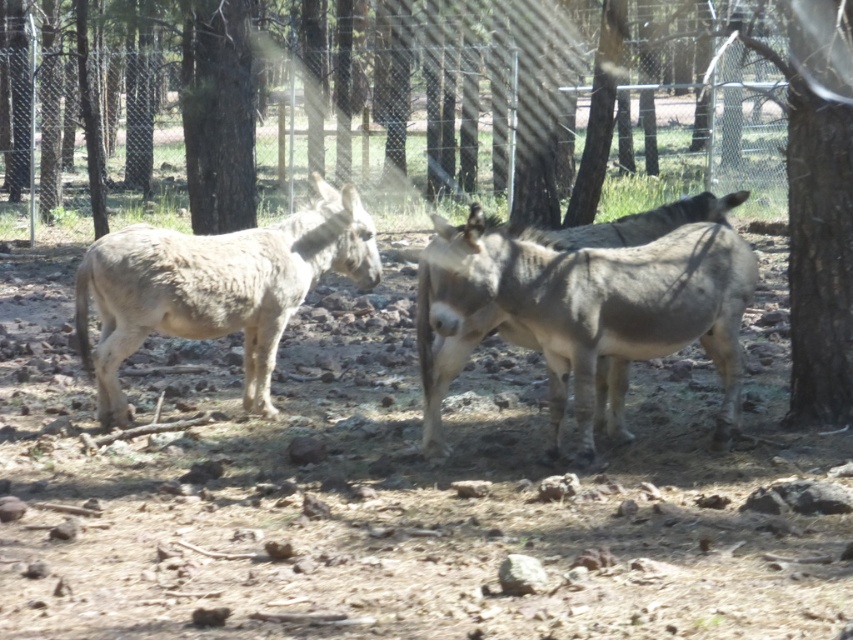
You are standing in front of the fence and looking at the two points marked on the image. Which point, point (457, 458) or point (90, 282), is closer to you?

Point (457, 458) is closer to you than point (90, 282).

Consider the image. You are standing in the wooded area and want to exit through the fence. Which direction should you go to find the metallic wire fence at upper center?

The metallic wire fence at upper center is located at point (474, 100), so you should head towards the upper center direction to find it.

You are a photographer trying to capture a clear shot of the gray rough fur mule at center and the brown rough bark tree at right. Since the mule is under the tree, will its shadow obscure part of the tree when the sun is directly overhead?

The gray rough fur mule at center is positioned under the brown rough bark tree at right, so when the sun is directly overhead, the tree will cast a shadow over the mule, not the other way around. Therefore, the mule will not obscure the tree with its shadow.